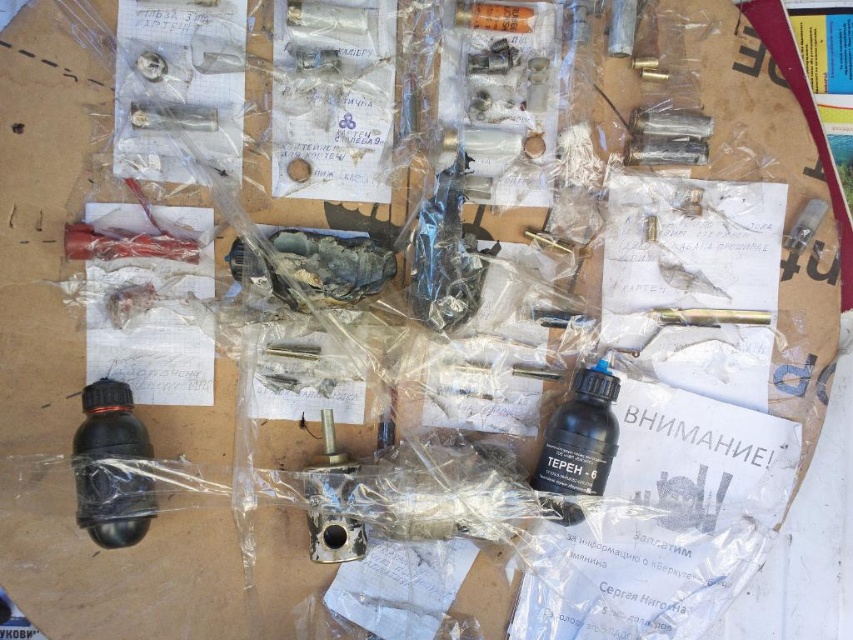
You are an engineer inspecting the mechanical parts on the workbench. You need to locate the black matte bottle at lower left and the black matte bottle at center. Which one is nearer to your current position?

The black matte bottle at lower left is closer to the viewer than the black matte bottle at center, so the black matte bottle at lower left is nearer to your current position.

You are an engineer inspecting the layout of mechanical parts on a workbench. You notice two points marked as coordinates on the surface. From your vantage point, which of the two points, point (122, 486) or point (608, 428), is closer to you?

Point (122, 486) is closer to the viewer than point (608, 428).